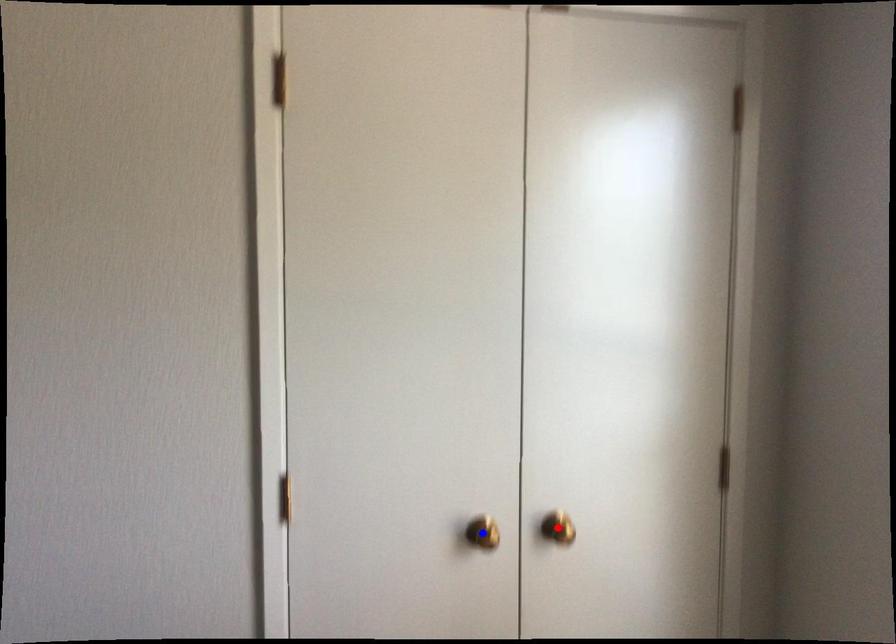
Question: Two points are marked on the image. Which point is closer to the camera?

Choices:
 (A) Blue point is closer.
 (B) Red point is closer.

Answer: (A)